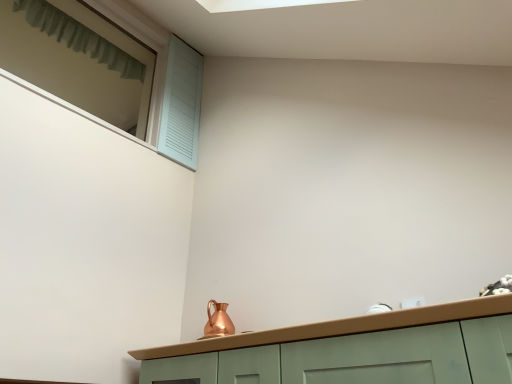
Question: Considering the positions of point (106, 109) and point (221, 304), is point (106, 109) closer or farther from the camera than point (221, 304)?

Choices:
 (A) farther
 (B) closer

Answer: (A)

Question: Is light blue wooden shutter at upper left wider or thinner than copper metallic pitcher at center?

Choices:
 (A) wide
 (B) thin

Answer: (A)

Question: Estimate the real-world distances between objects in this image. Which object is closer to the light blue wooden shutter at upper left?

Choices:
 (A) copper metallic pitcher at center
 (B) green fabric curtain at upper left

Answer: (B)

Question: Which of these objects is positioned farthest from the light blue wooden shutter at upper left?

Choices:
 (A) green fabric curtain at upper left
 (B) copper metallic pitcher at center

Answer: (B)